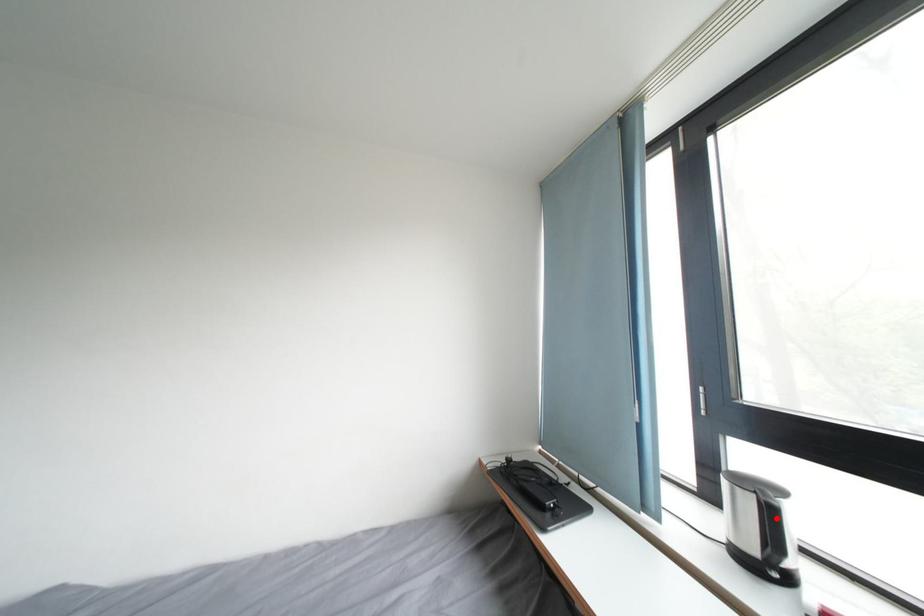
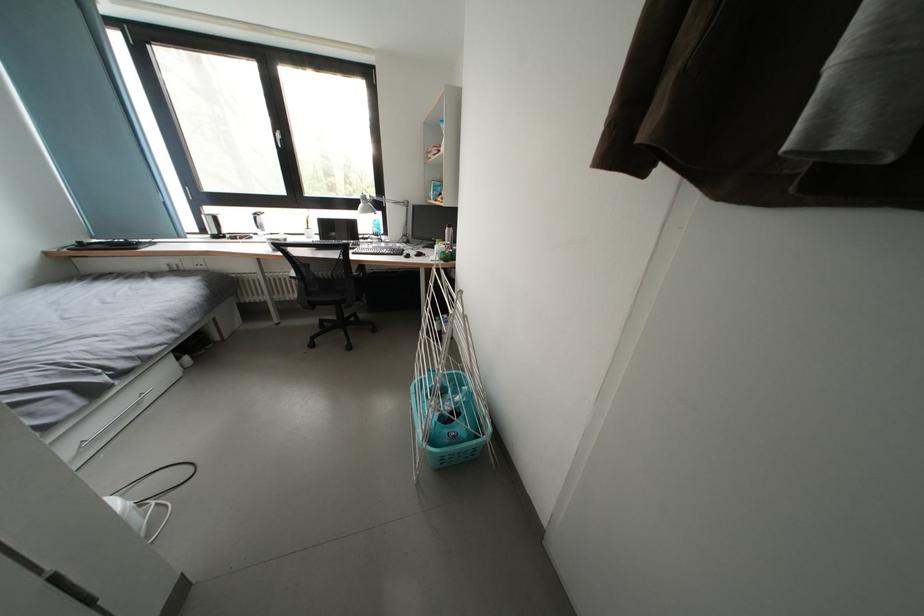
Question: I am providing you with two images of the same scene from different viewpoints. A red point is marked on the first image. Can you still see the location of the red point in image 2?

Choices:
 (A) Yes
 (B) No

Answer: (A)